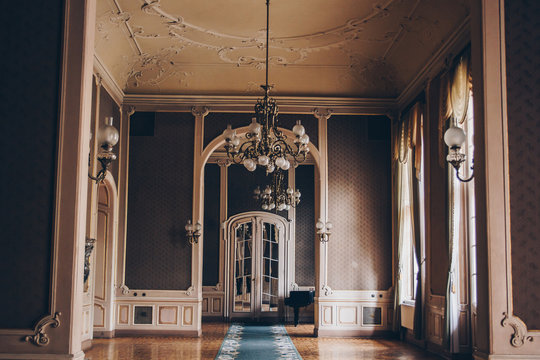
Find the location of a particular element. The image size is (540, 360). doors with windows is located at coordinates (252, 253), (267, 250).